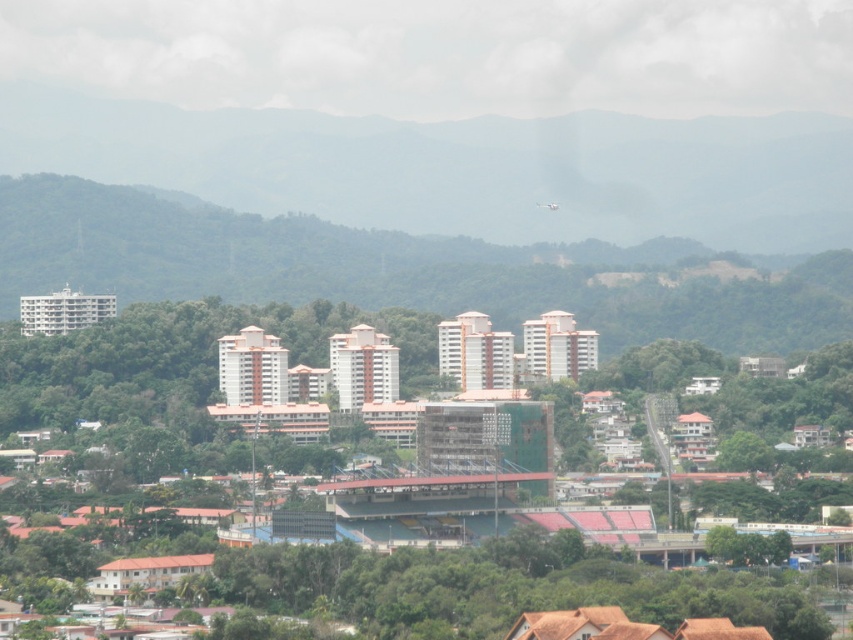
You are an urban planner reviewing this cityscape image. You need to determine the relative positions of the green leafy tree at lower right and the white matte airplane at upper center. From the perspective of someone standing at the center of the image, which object is located to the right?

The green leafy tree at lower right is positioned on the right side of the white matte airplane at upper center, so from the center perspective, the green leafy tree at lower right is to the right of the white matte airplane at upper center.

You are a drone operator tasked with capturing aerial footage of the city. You need to fly your drone from the green leafy forest at upper center to the green leafy forest at center. Given that your drone has a maximum flight range of 15 meters, will it be able to reach the second forest without recharging?

The distance between the green leafy forest at upper center and the green leafy forest at center is 16.50 meters. Since the drone can only fly up to 15 meters without recharging, it will not be able to reach the second forest without recharging.

You are an architect designing a new park in the city. You want to ensure that the view of the white matte airplane at upper center is not blocked by any trees. Given the current scene, is the green leafy tree at lower right currently blocking the airplane?

The white matte airplane at upper center is behind the green leafy tree at lower right, so yes, the tree is currently blocking the airplane.